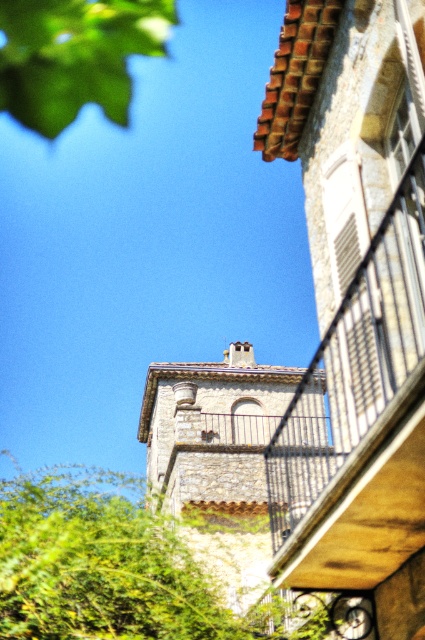
Is the position of green leafy tree at lower left more distant than that of green leafy tree at upper left?

No, green leafy tree at lower left is in front of green leafy tree at upper left.

Is point (184, 632) farther from viewer compared to point (79, 52)?

No.

At what (x,y) coordinates should I click in order to perform the action: click on green leafy tree at lower left. Please return your answer as a coordinate pair (x, y). The image size is (425, 640). Looking at the image, I should click on (116, 568).

Is stone textured bell tower at center above green leafy tree at upper left?

No.

Is stone textured bell tower at center behind green leafy tree at upper left?

No, it is not.

Which is behind, point (159, 452) or point (110, 106)?

Point (110, 106)

The width and height of the screenshot is (425, 640). Identify the location of stone textured bell tower at center. (224, 476).

Does point (104, 563) come farther from viewer compared to point (223, 374)?

That is False.

Which is more to the left, green leafy tree at lower left or stone textured bell tower at center?

From the viewer's perspective, green leafy tree at lower left appears more on the left side.

In order to click on green leafy tree at lower left in this screenshot , I will do `click(116, 568)`.

Locate an element on the screen. green leafy tree at lower left is located at coordinates (116, 568).